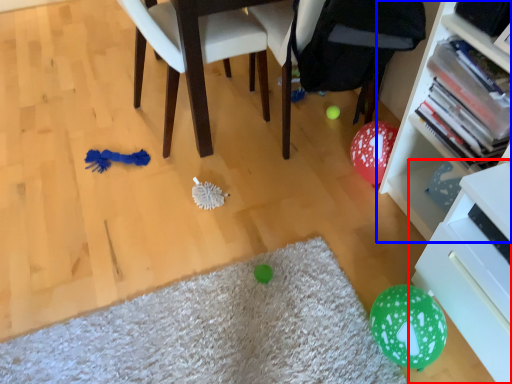
Question: Which object appears farthest to the camera in this image, shelf (highlighted by a red box) or bookcase (highlighted by a blue box)?

Choices:
 (A) shelf
 (B) bookcase

Answer: (B)